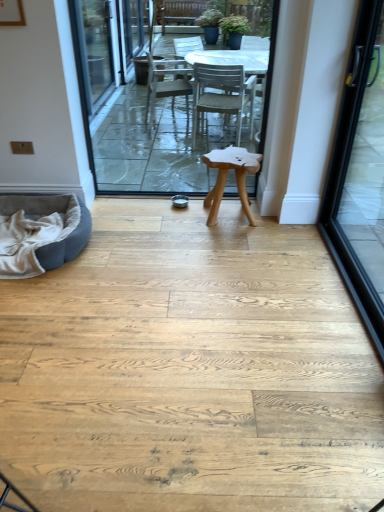
Where is `black glass door at right`? The width and height of the screenshot is (384, 512). black glass door at right is located at coordinates tap(360, 175).

What do you see at coordinates (360, 175) in the screenshot? The height and width of the screenshot is (512, 384). I see `black glass door at right` at bounding box center [360, 175].

Measure the distance between gray suede bean bag at lower left and camera.

gray suede bean bag at lower left is 2.44 meters from camera.

Identify the location of gray suede bean bag at lower left. The height and width of the screenshot is (512, 384). (40, 233).

At what (x,y) coordinates should I click in order to perform the action: click on black glass door at right. Please return your answer as a coordinate pair (x, y). Looking at the image, I should click on (360, 175).

Find the location of a particular element. This screenshot has height=512, width=384. terrace below the black glass door at right (from a real-world perspective) is located at coordinates (176, 95).

From a real-world perspective, is white plastic table at center physically below black glass door at right?

Yes, from a real-world perspective, white plastic table at center is below black glass door at right.

How distant is white plastic table at center from black glass door at right?

A distance of 1.76 meters exists between white plastic table at center and black glass door at right.

Is gray suede bean bag at lower left facing towards natural wood stool at center?

No, gray suede bean bag at lower left is not turned towards natural wood stool at center.

In the scene shown: Does gray suede bean bag at lower left come behind natural wood stool at center?

No, it is not.

Does point (29, 217) come behind point (251, 216)?

No, it is not.

Is natural wood stool at center aimed at gray suede bean bag at lower left?

Yes, natural wood stool at center is turned towards gray suede bean bag at lower left.

How many degrees apart are the facing directions of natural wood stool at center and gray suede bean bag at lower left?

There is a 0.342-degree angle between the facing directions of natural wood stool at center and gray suede bean bag at lower left.

The width and height of the screenshot is (384, 512). Identify the location of bean bag chair lying in front of the natural wood stool at center. [x=40, y=233].

Looking at this image, is black glass door at right taller than natural wood stool at center?

Yes, black glass door at right is taller than natural wood stool at center.

From the image's perspective, is black glass door at right located above or below natural wood stool at center?

From the image's perspective, black glass door at right appears below natural wood stool at center.

Is black glass door at right directly adjacent to natural wood stool at center?

No.

Which is behind, white plastic table at center or natural wood stool at center?

natural wood stool at center is behind.

From the image's perspective, is white plastic table at center under natural wood stool at center?

Actually, white plastic table at center appears above natural wood stool at center in the image.

Is white plastic table at center aimed at natural wood stool at center?

Yes, white plastic table at center is facing natural wood stool at center.

Which is behind, point (115, 113) or point (217, 199)?

Positioned behind is point (115, 113).

Is gray suede bean bag at lower left wider or thinner than white plastic table at center?

In the image, gray suede bean bag at lower left appears to be wider than white plastic table at center.

Is gray suede bean bag at lower left far from white plastic table at center?

That's right, there is a large distance between gray suede bean bag at lower left and white plastic table at center.

Find the location of a particular element. bean bag chair that is on the left side of white plastic table at center is located at coordinates (40, 233).

How distant is black glass door at right from gray suede bean bag at lower left?

1.87 meters.

Does point (345, 110) come closer to viewer compared to point (32, 218)?

Yes, point (345, 110) is closer to viewer.

Does black glass door at right touch gray suede bean bag at lower left?

black glass door at right and gray suede bean bag at lower left are clearly separated.

Where is `door in front of the white plastic table at center`? This screenshot has height=512, width=384. door in front of the white plastic table at center is located at coordinates (360, 175).

The image size is (384, 512). In order to click on stool above the gray suede bean bag at lower left (from the image's perspective) in this screenshot , I will do `click(226, 176)`.

Which object lies further to the anchor point gray suede bean bag at lower left, white plastic table at center or natural wood stool at center?

Among the two, white plastic table at center is located further to gray suede bean bag at lower left.

From the image, which object appears to be farther from black glass door at right, natural wood stool at center or gray suede bean bag at lower left?

gray suede bean bag at lower left lies further to black glass door at right than the other object.

Considering their positions, is black glass door at right positioned closer to natural wood stool at center than gray suede bean bag at lower left?

Among the two, black glass door at right is located nearer to natural wood stool at center.

Based on their spatial positions, is white plastic table at center or black glass door at right closer to gray suede bean bag at lower left?

The object closer to gray suede bean bag at lower left is white plastic table at center.

Considering their positions, is black glass door at right positioned further to white plastic table at center than natural wood stool at center?

Based on the image, black glass door at right appears to be further to white plastic table at center.

From the image, which object appears to be farther from natural wood stool at center, gray suede bean bag at lower left or black glass door at right?

The object further to natural wood stool at center is gray suede bean bag at lower left.

Considering their positions, is gray suede bean bag at lower left positioned further to white plastic table at center than black glass door at right?

black glass door at right lies further to white plastic table at center than the other object.

Based on their spatial positions, is natural wood stool at center or white plastic table at center further from gray suede bean bag at lower left?

white plastic table at center is further to gray suede bean bag at lower left.

Where is `terrace between gray suede bean bag at lower left and natural wood stool at center`? Image resolution: width=384 pixels, height=512 pixels. terrace between gray suede bean bag at lower left and natural wood stool at center is located at coordinates pyautogui.click(x=176, y=95).

You are a GUI agent. You are given a task and a screenshot of the screen. Output one action in this format:
    pyautogui.click(x=<x>, y=<y>)
    Task: Click on the stool located between gray suede bean bag at lower left and black glass door at right in the left-right direction
    The image size is (384, 512).
    Given the screenshot: What is the action you would take?
    pyautogui.click(x=226, y=176)

Identify the location of terrace situated between gray suede bean bag at lower left and black glass door at right from left to right. Image resolution: width=384 pixels, height=512 pixels. (176, 95).

The image size is (384, 512). I want to click on terrace between black glass door at right and natural wood stool at center from front to back, so click(176, 95).